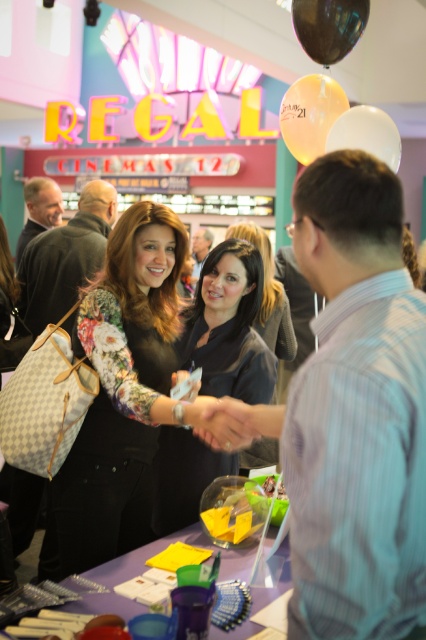
From the picture: You are planning to place a large cake on the purple plastic table at center. However, you notice a translucent white balloon at upper center nearby. Considering their sizes, can the cake fit on the table without the balloon obstructing it?

The purple plastic table at center has a greater width than the translucent white balloon at upper center, so the cake should fit on the table without the balloon obstructing it.